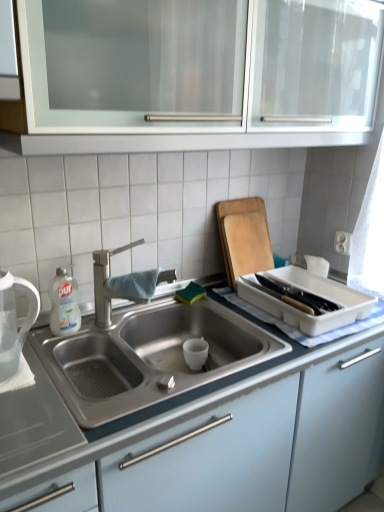
Question: From a real-world perspective, is white glass cabinet at upper center, which appears as the second cabinetry when ordered from the bottom, on top of wooden cutting board at upper right?

Choices:
 (A) yes
 (B) no

Answer: (A)

Question: Considering the relative sizes of white glass cabinet at upper center, the first cabinetry positioned from the top, and wooden cutting board at upper right in the image provided, is white glass cabinet at upper center, the first cabinetry positioned from the top, bigger than wooden cutting board at upper right?

Choices:
 (A) no
 (B) yes

Answer: (B)

Question: Does white glass cabinet at upper center, the first cabinetry positioned from the top, turn towards wooden cutting board at upper right?

Choices:
 (A) no
 (B) yes

Answer: (A)

Question: Is white glass cabinet at upper center, the first cabinetry positioned from the top, facing away from wooden cutting board at upper right?

Choices:
 (A) yes
 (B) no

Answer: (B)

Question: Is white glass cabinet at upper center, which appears as the second cabinetry when ordered from the bottom, in front of wooden cutting board at upper right?

Choices:
 (A) no
 (B) yes

Answer: (B)

Question: Is point (304, 431) positioned closer to the camera than point (349, 320)?

Choices:
 (A) farther
 (B) closer

Answer: (B)

Question: Based on their positions, is satin steel sink at center, the 1th cabinetry from the bottom, located to the left or right of white plastic tray at right?

Choices:
 (A) right
 (B) left

Answer: (B)

Question: Based on their sizes in the image, would you say satin steel sink at center, the 1th cabinetry from the bottom, is bigger or smaller than white plastic tray at right?

Choices:
 (A) small
 (B) big

Answer: (B)

Question: From a real-world perspective, is satin steel sink at center, the second cabinetry in the top-to-bottom sequence, positioned above or below white plastic tray at right?

Choices:
 (A) above
 (B) below

Answer: (B)

Question: Considering the positions of point (253, 480) and point (226, 201), is point (253, 480) closer or farther from the camera than point (226, 201)?

Choices:
 (A) farther
 (B) closer

Answer: (B)

Question: Looking at their shapes, would you say satin steel sink at center, the 1th cabinetry from the bottom, is wider or thinner than wooden cutting board at upper right?

Choices:
 (A) thin
 (B) wide

Answer: (B)

Question: Considering the positions of satin steel sink at center, the 1th cabinetry from the bottom, and wooden cutting board at upper right in the image, is satin steel sink at center, the 1th cabinetry from the bottom, taller or shorter than wooden cutting board at upper right?

Choices:
 (A) tall
 (B) short

Answer: (A)

Question: In terms of size, does satin steel sink at center, the second cabinetry in the top-to-bottom sequence, appear bigger or smaller than wooden cutting board at upper right?

Choices:
 (A) big
 (B) small

Answer: (A)

Question: From a real-world perspective, relative to white plastic tray at right, is wooden cutting board at upper right vertically above or below?

Choices:
 (A) below
 (B) above

Answer: (B)

Question: Is wooden cutting board at upper right inside or outside of white plastic tray at right?

Choices:
 (A) inside
 (B) outside

Answer: (B)